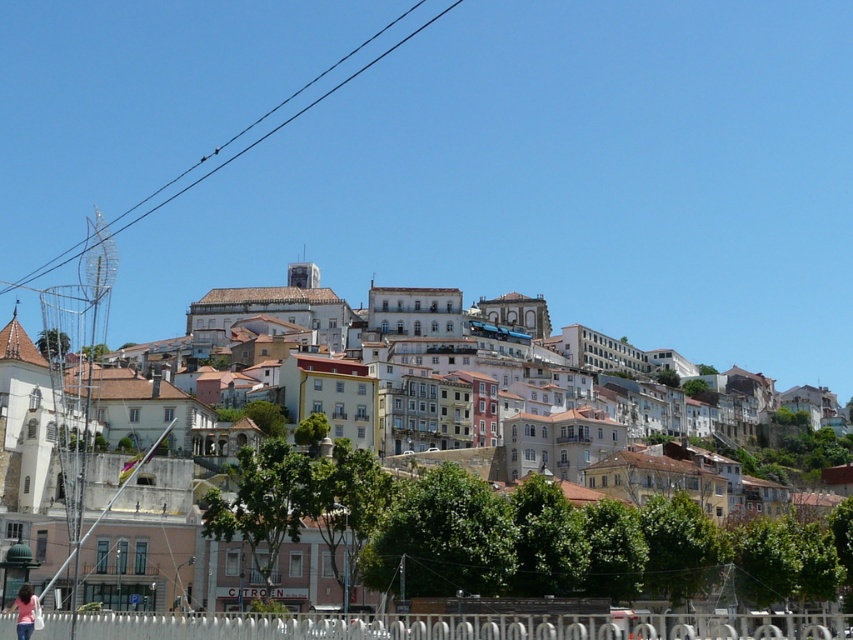
You are a tourist visiting the hillside town and want to take a photo that includes both the white stucco buildings at center and the light blue jeans at lower left. Which object should you position closer to the camera to ensure both are in the frame?

To include both the white stucco buildings at center and the light blue jeans at lower left in the frame, position the light blue jeans at lower left closer to the camera since it is smaller in size compared to the white stucco buildings at center.

You are a visitor standing at the bottom of the hill looking up towards the town. You notice the black wire at upper center and the light blue jeans at lower left. Which object appears bigger in your view?

The black wire at upper center appears bigger because it has a larger size compared to the light blue jeans at lower left.